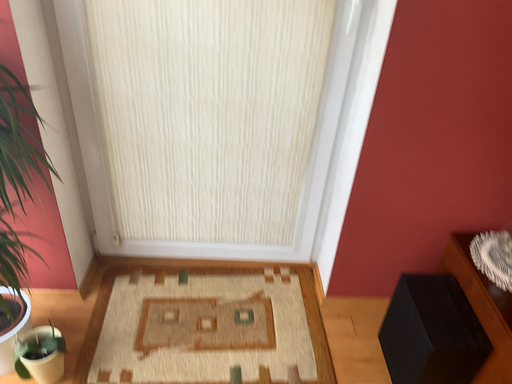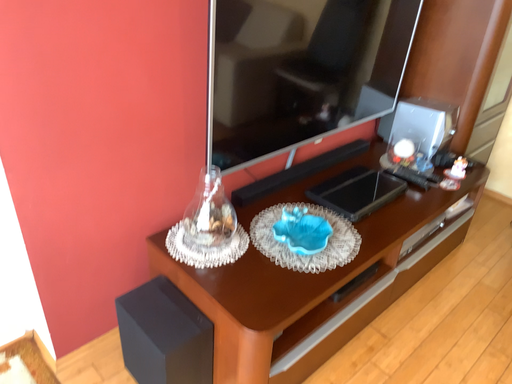
Question: How did the camera likely rotate when shooting the video?

Choices:
 (A) rotated downward
 (B) rotated upward

Answer: (B)